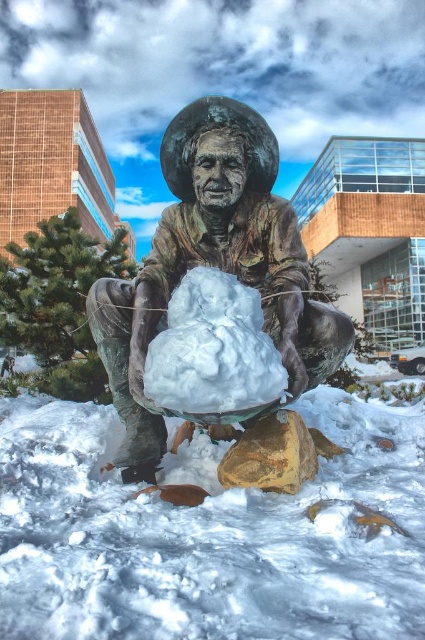
The image size is (425, 640). In order to click on bronze statue at center in this screenshot , I will do `click(214, 266)`.

Is point (238, 129) positioned in front of point (311, 460)?

No, (238, 129) is behind (311, 460).

At what (x,y) coordinates should I click in order to perform the action: click on bronze statue at center. Please return your answer as a coordinate pair (x, y). Looking at the image, I should click on (214, 266).

Which of these two, bronze statue at center or white fluffy snowman at center, stands taller?

bronze statue at center

Does point (136, 413) come in front of point (210, 346)?

No, (136, 413) is further to viewer.

The image size is (425, 640). I want to click on bronze statue at center, so click(x=214, y=266).

Identify the location of bronze statue at center. This screenshot has height=640, width=425. (214, 266).

Is white fluffy snow at center shorter than bronze statue at center?

Yes, white fluffy snow at center is shorter than bronze statue at center.

Which of these two, white fluffy snow at center or bronze statue at center, stands taller?

Standing taller between the two is bronze statue at center.

Describe the element at coordinates (207, 532) in the screenshot. Image resolution: width=425 pixels, height=640 pixels. I see `white fluffy snow at center` at that location.

You are a GUI agent. You are given a task and a screenshot of the screen. Output one action in this format:
    pyautogui.click(x=<x>, y=<y>)
    Task: Click on the white fluffy snow at center
    
    Given the screenshot: What is the action you would take?
    pyautogui.click(x=207, y=532)